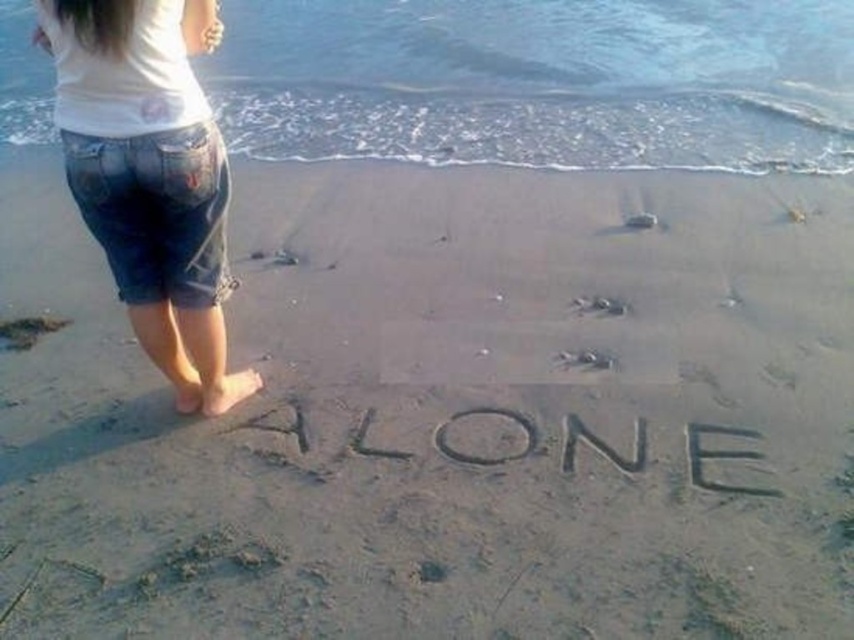
You are a photographer capturing the scene at the beach. You want to ensure that the denim shorts at left are positioned exactly at point 0.277, 0.178 in your frame. How can you adjust your camera to achieve this?

The denim shorts at left are already positioned at point (151, 177) in the frame according to the provided coordinates, so no adjustment is needed.